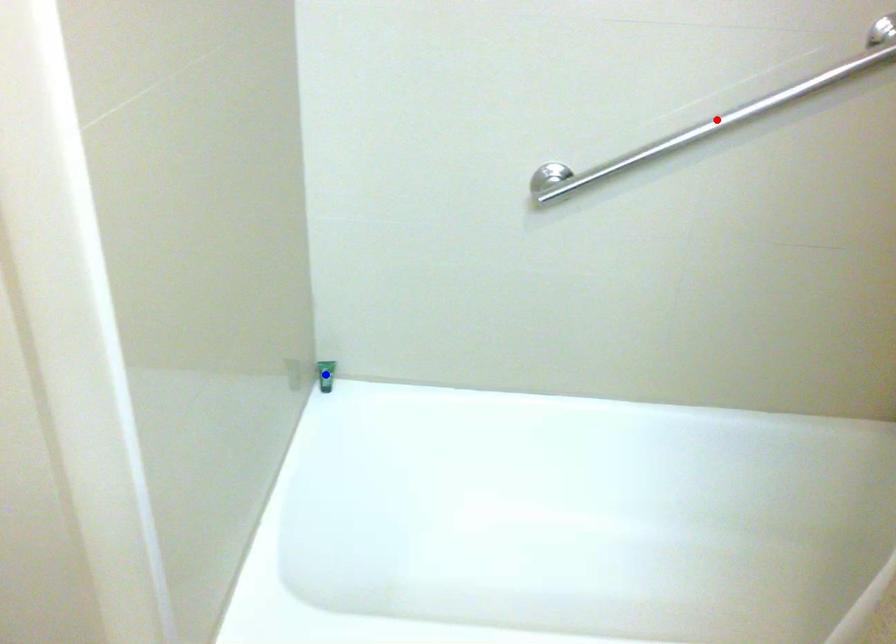
Question: Two points are marked on the image. Which point is closer to the camera?

Choices:
 (A) Blue point is closer.
 (B) Red point is closer.

Answer: (B)